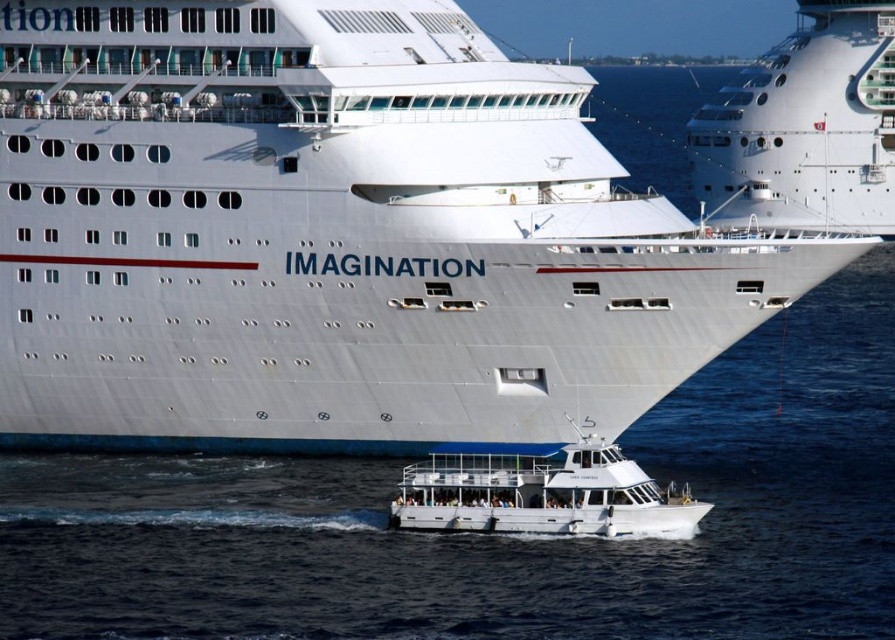
You are a passenger on the white glossy cruise ship at center and want to board the white glossy ship at upper center. Can you reach the ship at upper center from your current position without climbing higher than the cruise ship?

The white glossy ship at upper center is taller than the white glossy cruise ship at center, so you cannot reach it without climbing higher.